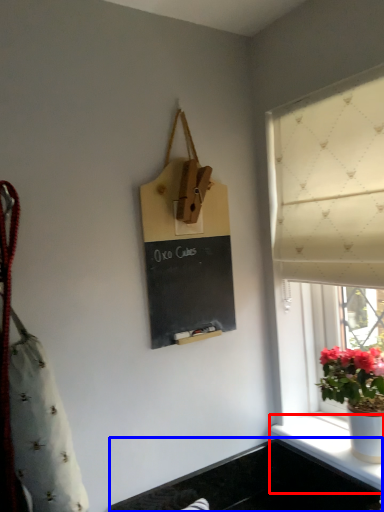
Question: Which object is closer to the camera taking this photo, window sill (highlighted by a red box) or sink (highlighted by a blue box)?

Choices:
 (A) window sill
 (B) sink

Answer: (A)